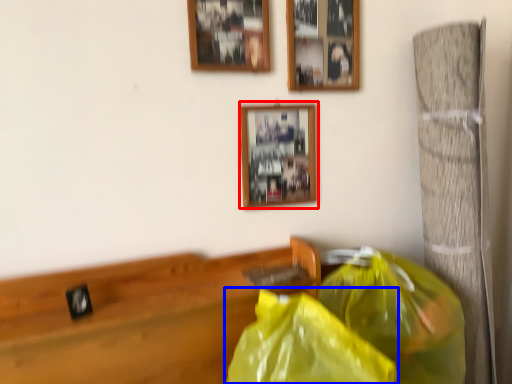
Question: Which object appears farthest to the camera in this image, picture frame (highlighted by a red box) or plastic bag (highlighted by a blue box)?

Choices:
 (A) picture frame
 (B) plastic bag

Answer: (A)